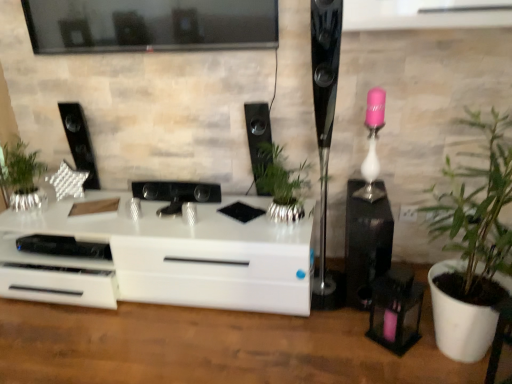
Identify the location of free space in front of black glossy speaker at right, which ranks as the 4th speaker in left-to-right order. The height and width of the screenshot is (384, 512). (361, 339).